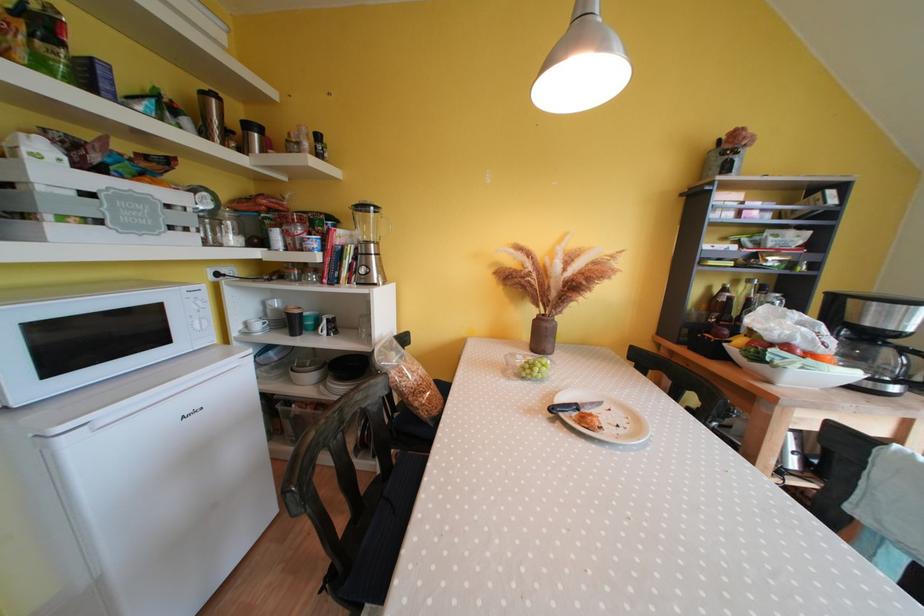
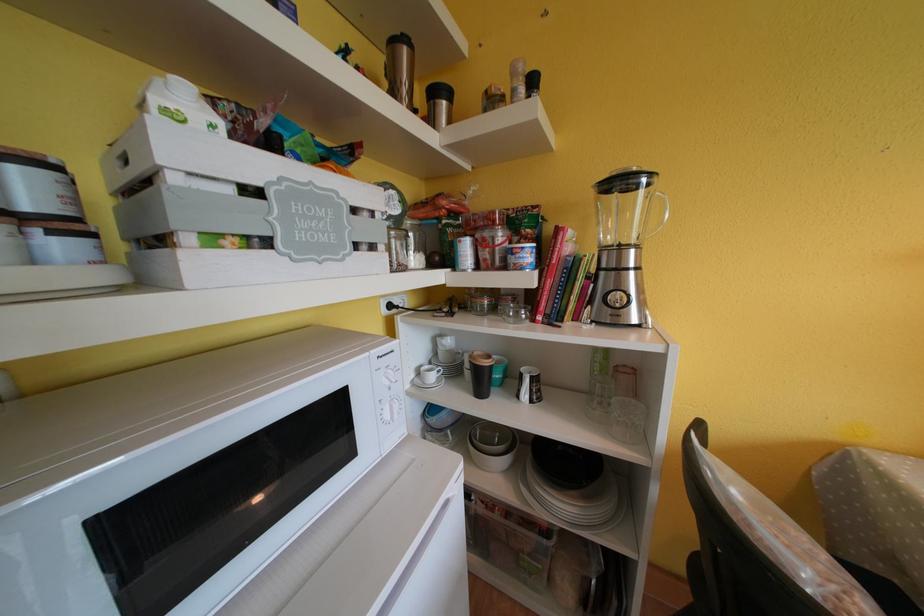
What movement of the cameraman would produce the second image?

The movement direction of the cameraman is left, forward.